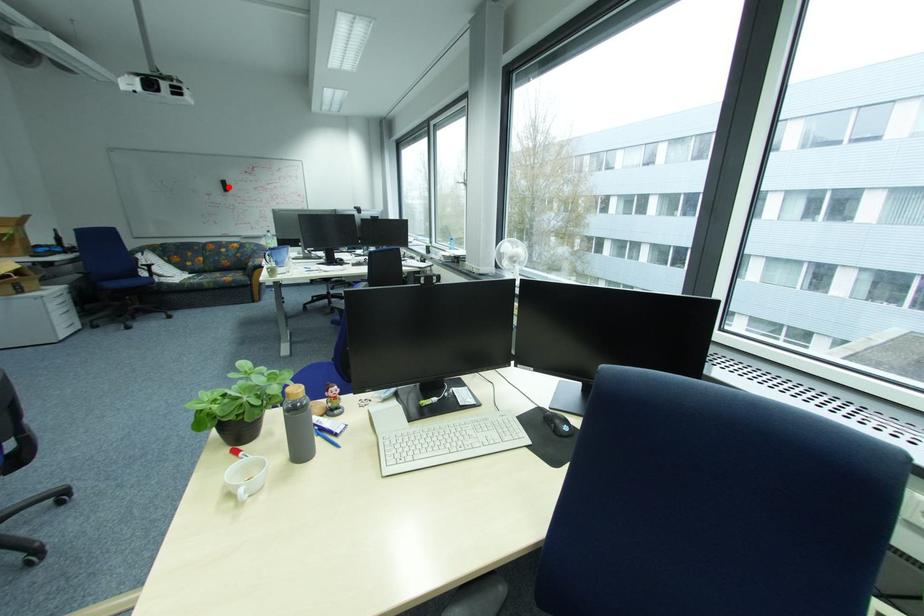
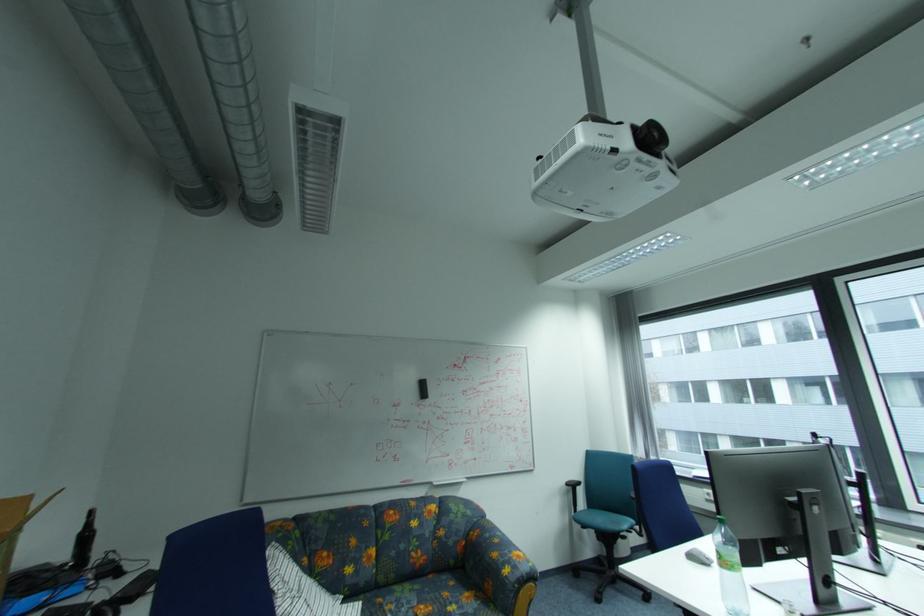
Question: I am providing you with two images of the same scene from different viewpoints. A red point is marked on the first image. At the location where the point appears in image 1, is it still visible in image 2?

Choices:
 (A) Yes
 (B) No

Answer: (A)